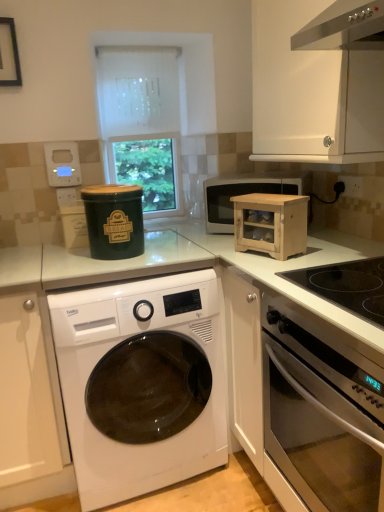
Locate an element on the screen. Image resolution: width=384 pixels, height=512 pixels. blank space to the left of natural wood cabinet at right is located at coordinates (230, 257).